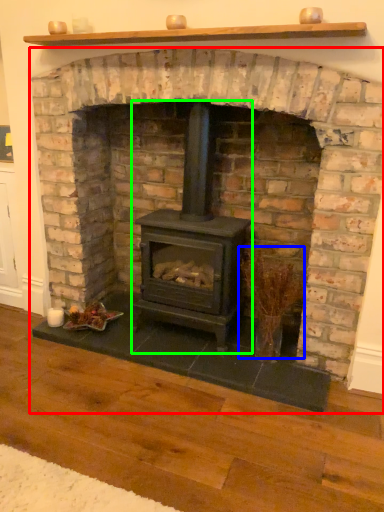
Question: Which object is the farthest from fireplace (highlighted by a red box)? Choose among these: twig (highlighted by a blue box) or wood burning stove (highlighted by a green box).

Choices:
 (A) twig
 (B) wood burning stove

Answer: (A)